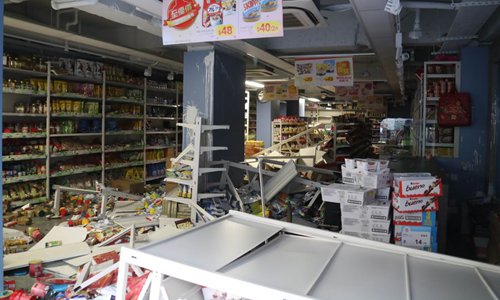
Locate an element on the screen. This screenshot has width=500, height=300. broken standing shelf is located at coordinates (194, 178), (195, 148).